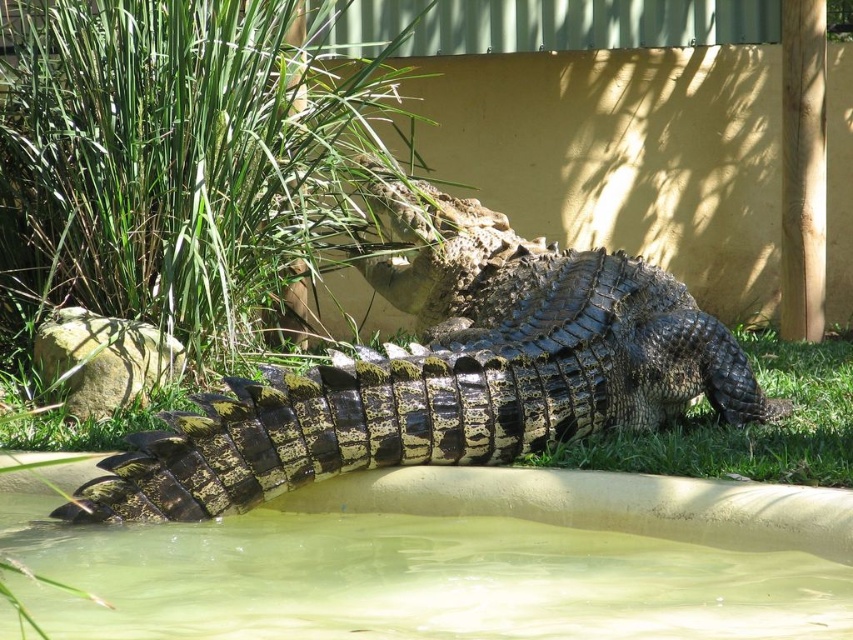
Question: Which object appears farthest from the camera in this image?

Choices:
 (A) shiny black crocodile at center
 (B) greenish murky water at bottom

Answer: (A)

Question: Is shiny black crocodile at center smaller than greenish murky water at bottom?

Choices:
 (A) no
 (B) yes

Answer: (A)

Question: Can you confirm if shiny black crocodile at center is bigger than greenish murky water at bottom?

Choices:
 (A) no
 (B) yes

Answer: (B)

Question: Can you confirm if shiny black crocodile at center is wider than greenish murky water at bottom?

Choices:
 (A) no
 (B) yes

Answer: (B)

Question: Which object appears farthest from the camera in this image?

Choices:
 (A) shiny black crocodile at center
 (B) greenish murky water at bottom

Answer: (A)